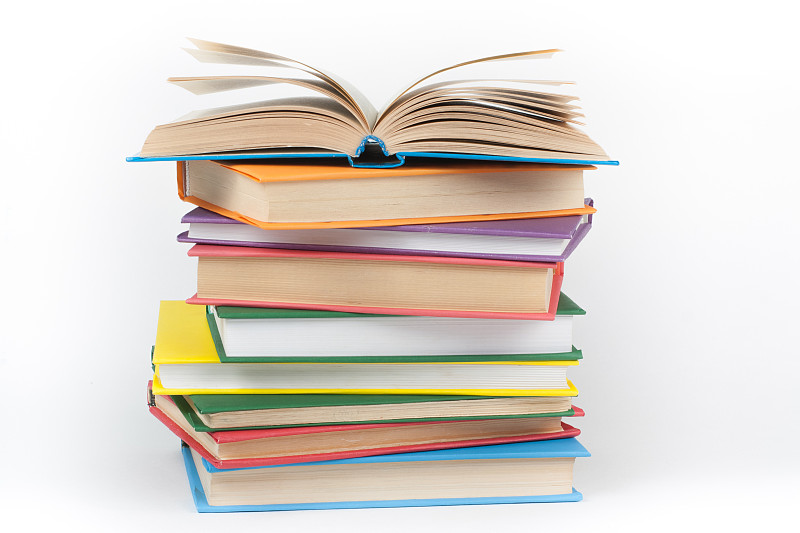
Locate an element on the screen. The width and height of the screenshot is (800, 533). books is located at coordinates (328, 131), (344, 190), (468, 240), (440, 287), (398, 334), (408, 374), (405, 407), (396, 435), (408, 471).